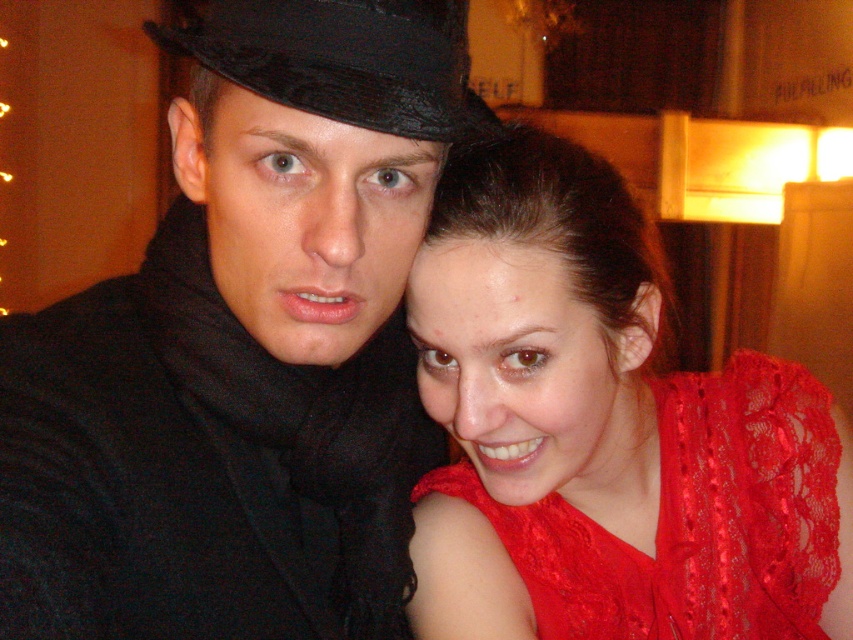
In the scene shown: Between lace fabric dress at upper right and black satin fedora at upper left, which one is positioned lower?

lace fabric dress at upper right is below.

Who is more forward, [639,364] or [456,33]?

Point [456,33]

Between point (612, 493) and point (231, 28), which one is positioned in front?

Point (231, 28) is more forward.

Where is `lace fabric dress at upper right`? This screenshot has width=853, height=640. lace fabric dress at upper right is located at coordinates (602, 432).

Is point (35, 416) positioned before point (492, 584)?

Yes.

Describe the element at coordinates (244, 348) in the screenshot. This screenshot has width=853, height=640. I see `matte black hat at upper center` at that location.

Locate an element on the screen. This screenshot has width=853, height=640. matte black hat at upper center is located at coordinates (244, 348).

Which of these two, matte black hat at upper center or black satin fedora at upper left, stands taller?

Standing taller between the two is matte black hat at upper center.

This screenshot has height=640, width=853. I want to click on matte black hat at upper center, so click(244, 348).